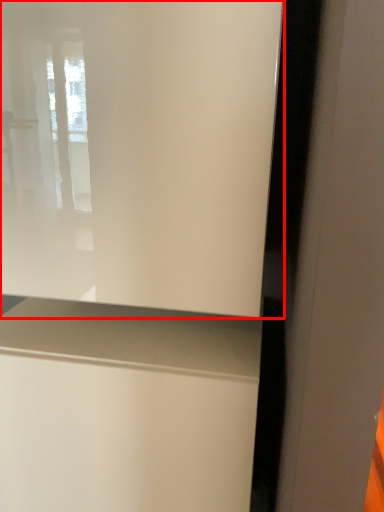
Question: In this image, where is window (annotated by the red box) located relative to vanity?

Choices:
 (A) left
 (B) right

Answer: (B)